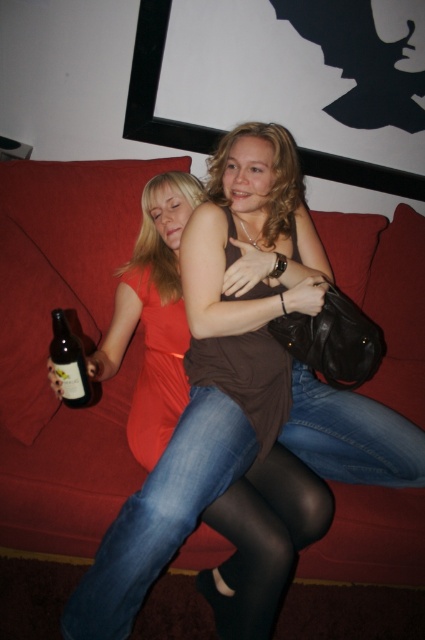
What is the exact coordinate of the jeans at lower right?

The jeans at lower right is located at point (351, 435).

In the scene shown: You are a photographer trying to capture a closeup of the translucent glass bottle at lower left without including the jeans at lower right in the frame. Given their sizes, is this feasible?

The jeans at lower right is bigger than the translucent glass bottle at lower left, so it might be challenging to exclude the jeans at lower right from the frame due to its larger size unless positioned carefully.

Consider the image. You are a delivery robot with a package that measures 30 centimeters in length. You need to place it between the red fabric couch at center and the black tights at lower center. Is there enough space for the package?

The distance between the red fabric couch at center and the black tights at lower center is 26.27 centimeters. Since the package is 30 centimeters long, it will not fit in the available space.